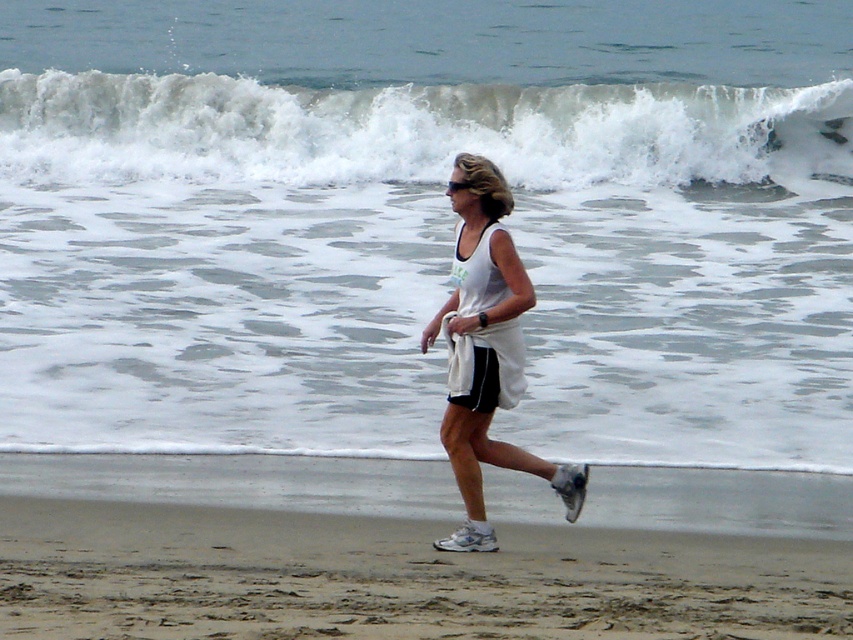
Who is more distant from viewer, (572,598) or (611,120)?

The point (611,120) is more distant.

Measure the distance between sandy brown at lower center and camera.

They are 7.64 meters apart.

Locate an element on the screen. The image size is (853, 640). sandy brown at lower center is located at coordinates (396, 577).

Is point (137, 513) more distant than point (471, 499)?

Yes, point (137, 513) is farther from viewer.

Locate an element on the screen. This screenshot has width=853, height=640. sandy brown at lower center is located at coordinates (396, 577).

Which is in front, point (80, 536) or point (582, 477)?

Point (80, 536)

The image size is (853, 640). In order to click on sandy brown at lower center in this screenshot , I will do `click(396, 577)`.

This screenshot has width=853, height=640. I want to click on white frothy wave at upper center, so click(x=416, y=132).

Between white frothy wave at upper center and white fabric tank top at center, which one appears on the right side from the viewer's perspective?

Positioned to the right is white frothy wave at upper center.

Does point (102, 156) come farther from viewer compared to point (492, 362)?

Yes, point (102, 156) is farther from viewer.

Image resolution: width=853 pixels, height=640 pixels. I want to click on white frothy wave at upper center, so pyautogui.click(x=416, y=132).